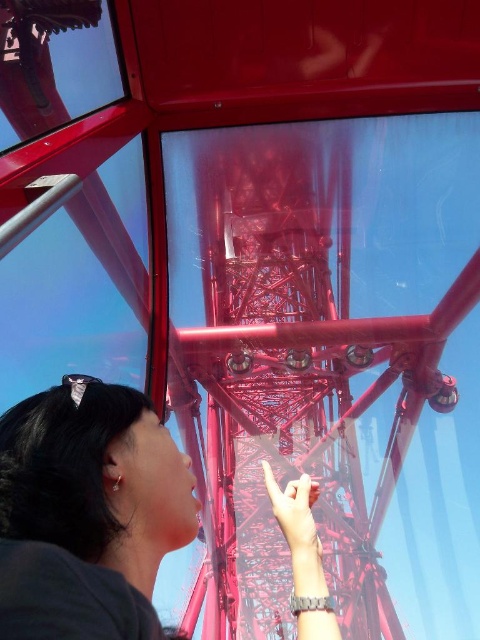
You are an architect designing a miniature model of this Ferris wheel gondola. You need to ensure that the metallic red eiffel tower at center and the matte black hair at upper left are scaled correctly. Which object should be made bigger in the model to maintain the original proportions?

The metallic red eiffel tower at center should be made bigger in the model than the matte black hair at upper left to maintain the original proportions, as it is larger in size than the matte black hair at upper left.

You are a maintenance worker on a red Ferris wheel gondola. You need to reach the metallic red eiffel tower at center from the matte black hair at upper left. Given that your ladder can extend up to 100 feet, will it be sufficient to bridge the gap between them?

The distance between the metallic red eiffel tower at center and the matte black hair at upper left is 129.88 feet. Since the ladder can only extend to 100 feet, it will not be sufficient to bridge the gap between them.

You are standing inside the red Ferris wheel gondola and want to take a photo of the metallic red eiffel tower at center. Where should you aim your camera to capture it?

You should aim your camera at point (271, 368) to capture the metallic red eiffel tower at center.